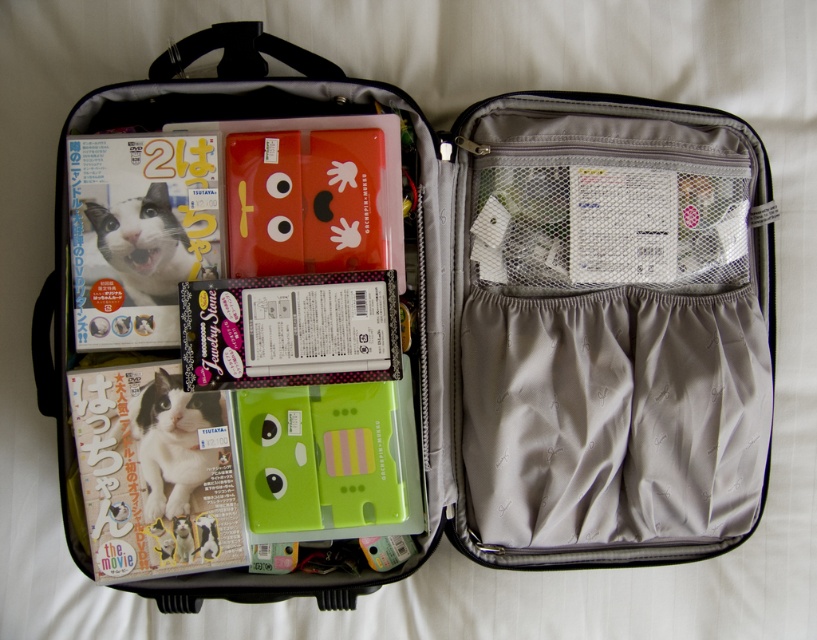
Question: Does matte paper magazine at lower left appear on the right side of matte paper magazine at left?

Choices:
 (A) no
 (B) yes

Answer: (B)

Question: Is matte paper magazine at lower left behind matte paper magazine at left?

Choices:
 (A) no
 (B) yes

Answer: (A)

Question: Among these points, which one is farthest from the camera?

Choices:
 (A) (110, 464)
 (B) (141, 132)

Answer: (B)

Question: Is matte paper magazine at lower left positioned at the back of matte paper magazine at left?

Choices:
 (A) yes
 (B) no

Answer: (B)

Question: Which point appears farthest from the camera in this image?

Choices:
 (A) (158, 426)
 (B) (221, 257)

Answer: (B)